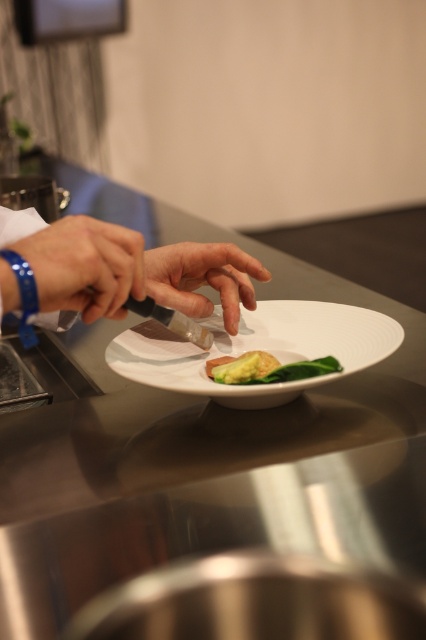
You are a chef who needs to place a garnish on the white glossy plate at center without touching the blue rubber band at center. Can you do this if the garnish requires a 6 inch space?

The white glossy plate at center is 6.01 inches from the blue rubber band at center, so yes, the garnish can be placed on the plate without touching the rubber band as there is enough space.

You are a chef trying to locate the blue rubber band at center on a stainless steel countertop. Based on the coordinates provided, can you determine its exact position relative to the edges of the countertop?

The blue rubber band at center is located at the coordinates 0.416 on the x axis and 0.200 on the y axis relative to the edges of the stainless steel countertop.